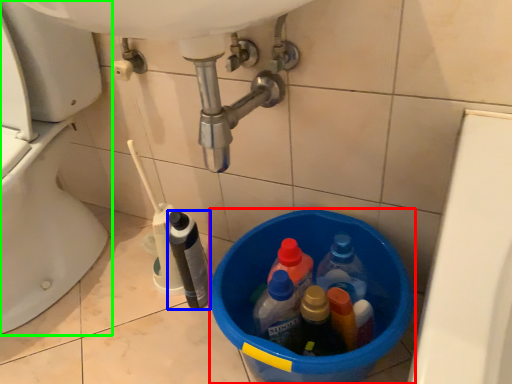
Question: Based on their relative distances, which object is farther from basin (highlighted by a red box)? Choose from bottle (highlighted by a blue box) and toilet (highlighted by a green box).

Choices:
 (A) bottle
 (B) toilet

Answer: (B)